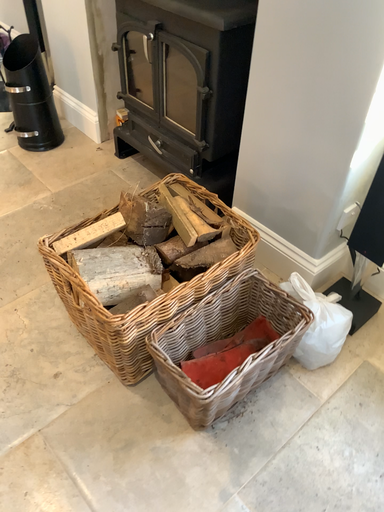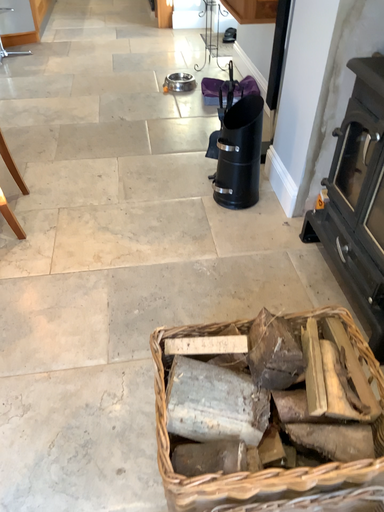
Question: Which way did the camera rotate in the video?

Choices:
 (A) rotated right
 (B) rotated left

Answer: (B)